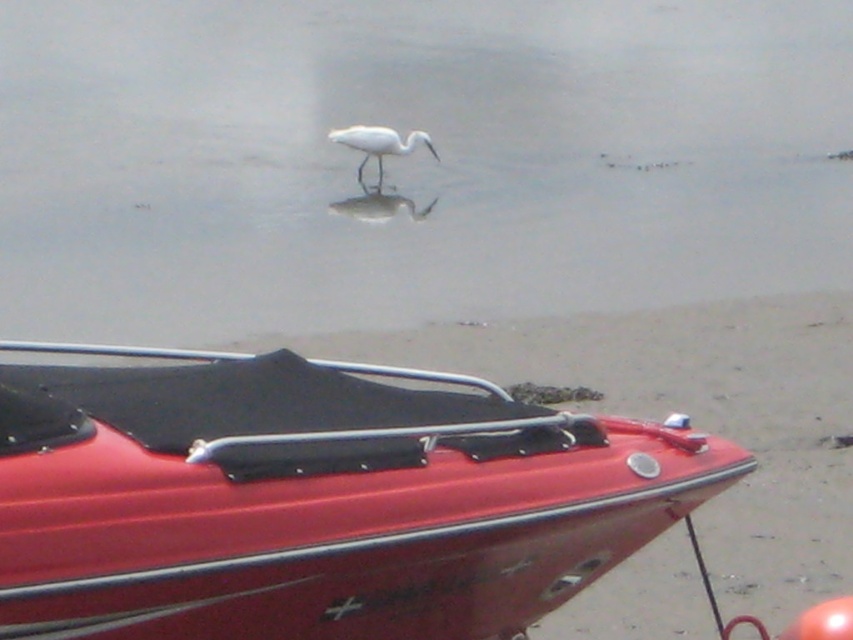
Between white matte water at center and white matte bird at center, which one appears on the right side from the viewer's perspective?

From the viewer's perspective, white matte water at center appears more on the right side.

Does white matte water at center appear over white matte bird at center?

Yes.

What do you see at coordinates (412, 161) in the screenshot? I see `white matte water at center` at bounding box center [412, 161].

Identify the location of white matte water at center. Image resolution: width=853 pixels, height=640 pixels. [412, 161].

Which is below, white matte water at center or shiny red boat at lower center?

shiny red boat at lower center is below.

Who is taller, white matte water at center or shiny red boat at lower center?

Standing taller between the two is white matte water at center.

Which is behind, point (276, 259) or point (216, 573)?

The point (276, 259) is more distant.

At what (x,y) coordinates should I click in order to perform the action: click on white matte water at center. Please return your answer as a coordinate pair (x, y). The width and height of the screenshot is (853, 640). Looking at the image, I should click on (412, 161).

Who is taller, shiny red boat at lower center or white matte bird at center?

With more height is shiny red boat at lower center.

In the scene shown: Is shiny red boat at lower center below white matte bird at center?

Yes.

The image size is (853, 640). In order to click on shiny red boat at lower center in this screenshot , I will do `click(314, 499)`.